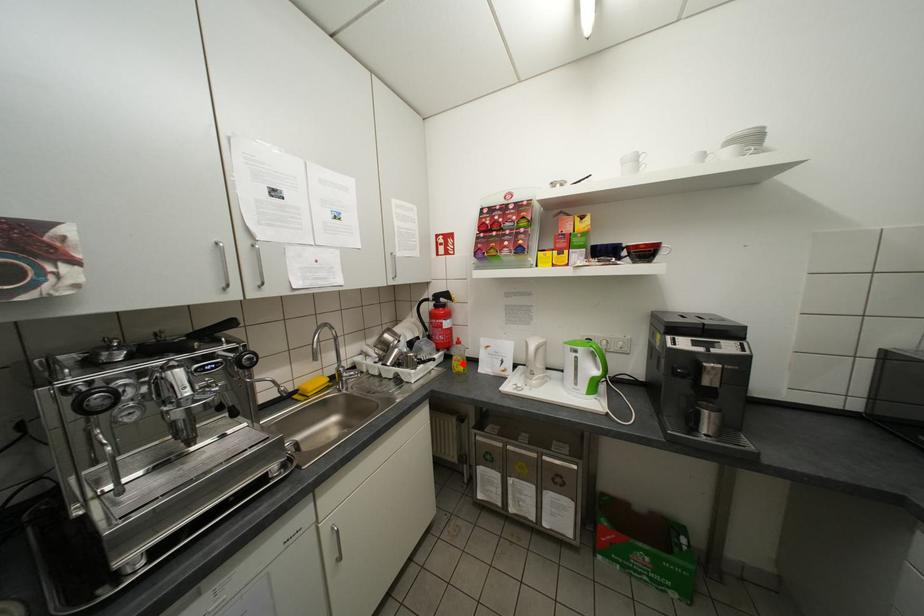
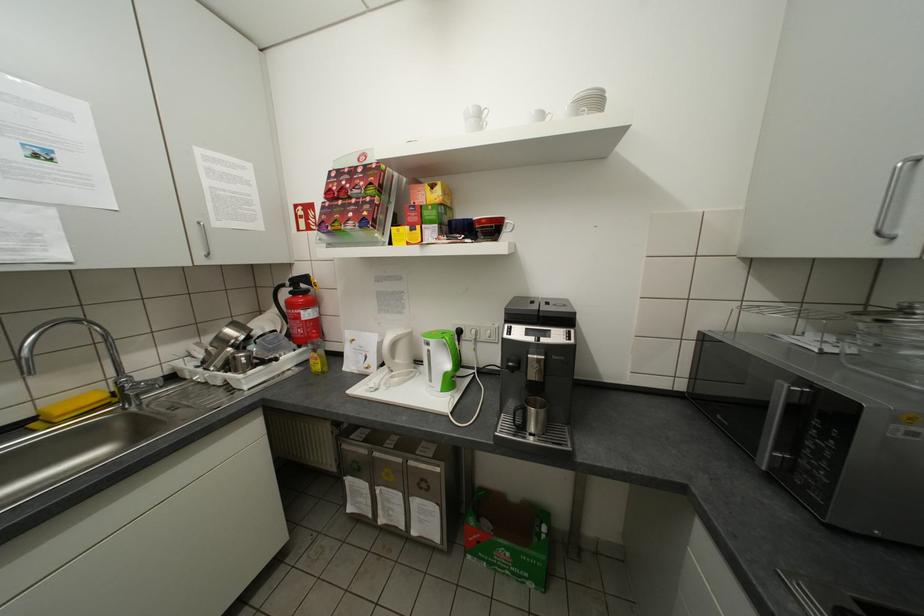
The point at the highlighted location is marked in the first image. Where is the corresponding point in the second image?

(321, 362)